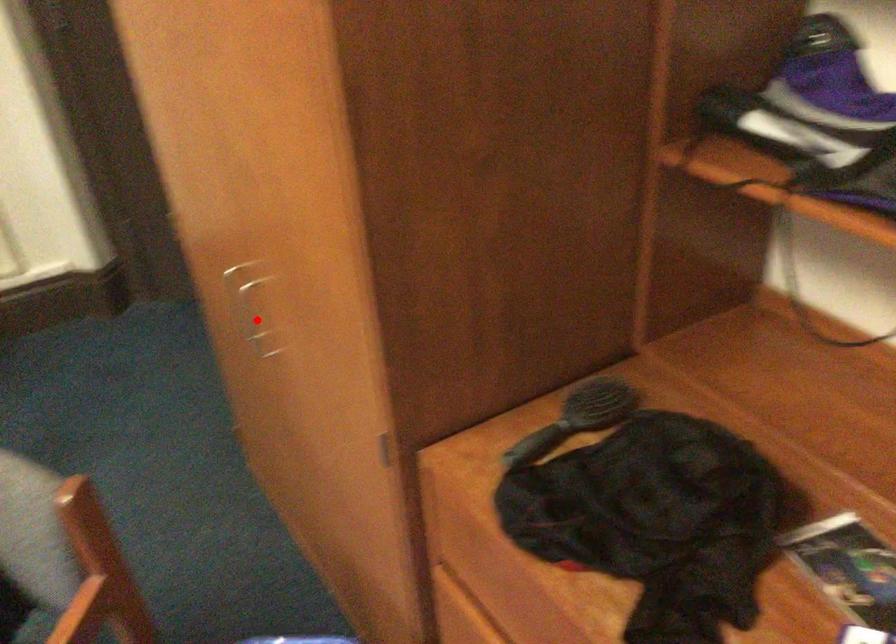
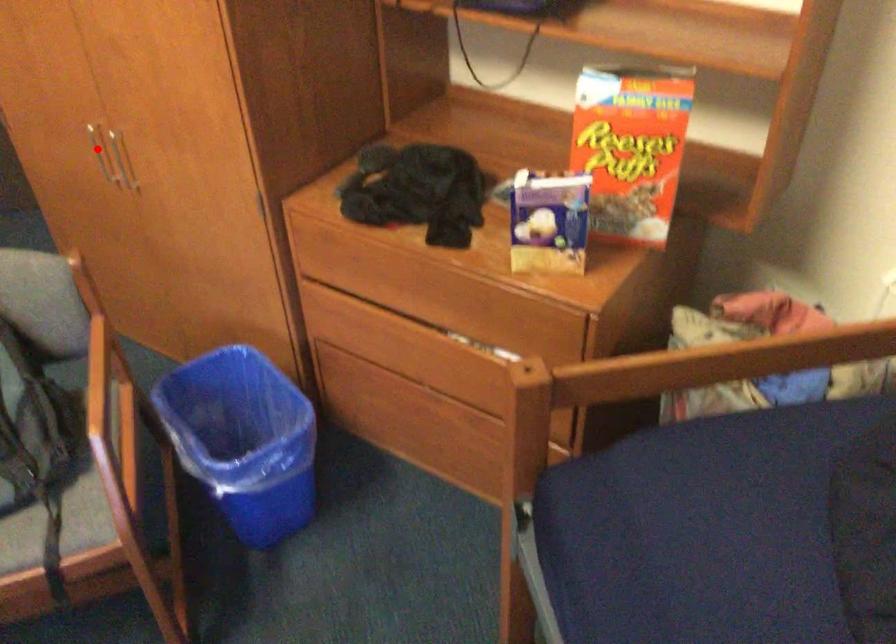
I am providing you with two images of the same scene from different viewpoints. A red point is marked on the first image and another point is marked on the second image. Is the red point in image1 aligned with the point shown in image2?

No